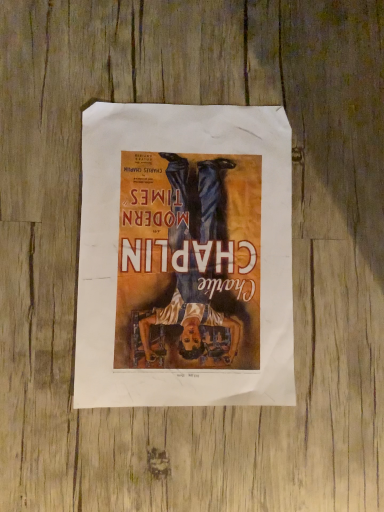
Find the location of a particular element. The image size is (384, 512). matte paper poster at center is located at coordinates pos(185,257).

What do you see at coordinates (185, 257) in the screenshot? Image resolution: width=384 pixels, height=512 pixels. I see `matte paper poster at center` at bounding box center [185, 257].

At what (x,y) coordinates should I click in order to perform the action: click on matte paper poster at center. Please return your answer as a coordinate pair (x, y). This screenshot has width=384, height=512. Looking at the image, I should click on (185, 257).